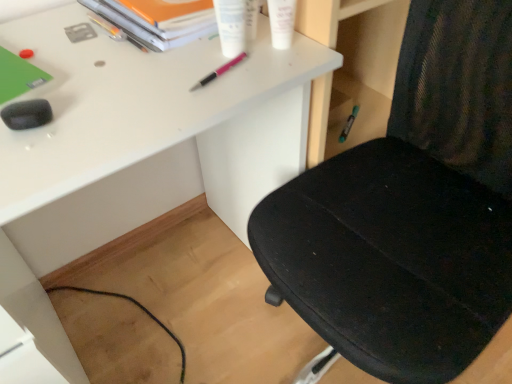
What do you see at coordinates (106, 27) in the screenshot?
I see `metallic silver pen at upper left, the fifth stationery positioned from the front` at bounding box center [106, 27].

What do you see at coordinates (231, 26) in the screenshot?
I see `white plastic tubes at upper center, the fourth stationery positioned from the back` at bounding box center [231, 26].

What are the coordinates of `black mesh chair at right` in the screenshot? It's located at (409, 210).

Where is `teal plastic pen at center-right, arranged as the 1th stationery when viewed from the right`? The width and height of the screenshot is (512, 384). teal plastic pen at center-right, arranged as the 1th stationery when viewed from the right is located at coordinates (348, 124).

What are the coordinates of `orange matte paper at upper center` in the screenshot? It's located at (158, 20).

Find the location of a particular element. This screenshot has width=512, height=384. metallic silver pen at upper left, placed as the 2th stationery when sorted from back to front is located at coordinates (106, 27).

Does white matte tube at upper center, the fifth stationery from the left, touch matte black earbuds at left, the sixth stationery positioned from the back?

No, white matte tube at upper center, the fifth stationery from the left, is not next to matte black earbuds at left, the sixth stationery positioned from the back.

From a real-world perspective, is white matte tube at upper center, which is counted as the second stationery, starting from the front, physically located above or below matte black earbuds at left, the sixth stationery positioned from the back?

white matte tube at upper center, which is counted as the second stationery, starting from the front, is situated higher than matte black earbuds at left, the sixth stationery positioned from the back, in the real world.

Considering the positions of objects white matte tube at upper center, the fifth stationery from the left, and matte black earbuds at left, the first stationery when ordered from left to right, in the image provided, who is more to the right, white matte tube at upper center, the fifth stationery from the left, or matte black earbuds at left, the first stationery when ordered from left to right,?

Positioned to the right is white matte tube at upper center, the fifth stationery from the left.

From a real-world perspective, is matte black earbuds at left, the first stationery when ordered from left to right, physically below black mesh chair at right?

No, from a real-world perspective, matte black earbuds at left, the first stationery when ordered from left to right, is not below black mesh chair at right.

In the scene shown: Is the depth of matte black earbuds at left, the 1th stationery in the front-to-back sequence, less than that of black mesh chair at right?

No, the depth of matte black earbuds at left, the 1th stationery in the front-to-back sequence, is greater than that of black mesh chair at right.

Is matte black earbuds at left, the sixth stationery positioned from the back, oriented away from black mesh chair at right?

No.

From the image's perspective, is matte black earbuds at left, the sixth stationery positioned from the back, located above black mesh chair at right?

Yes, from the image's perspective, matte black earbuds at left, the sixth stationery positioned from the back, is on top of black mesh chair at right.

Is white matte tube at upper center, the fifth stationery from the left, wider or thinner than pink metallic pen at upper center, the 4th stationery when ordered from right to left?

white matte tube at upper center, the fifth stationery from the left, is wider than pink metallic pen at upper center, the 4th stationery when ordered from right to left.

Is white matte tube at upper center, positioned as the 2th stationery in right-to-left order, to the left of pink metallic pen at upper center, the 4th stationery when ordered from right to left, from the viewer's perspective?

No, white matte tube at upper center, positioned as the 2th stationery in right-to-left order, is not to the left of pink metallic pen at upper center, the 4th stationery when ordered from right to left.

From a real-world perspective, which object stands above the other?

white matte tube at upper center, positioned as the 2th stationery in right-to-left order, is physically above.

From the image's perspective, would you say white matte tube at upper center, the fifth stationery from the back, is shown under pink metallic pen at upper center, placed as the third stationery when sorted from back to front?

Incorrect, from the image's perspective, white matte tube at upper center, the fifth stationery from the back, is higher than pink metallic pen at upper center, placed as the third stationery when sorted from back to front.

In terms of width, does pink metallic pen at upper center, the 4th stationery when ordered from right to left, look wider or thinner when compared to matte black earbuds at left, the 1th stationery in the front-to-back sequence?

Considering their sizes, pink metallic pen at upper center, the 4th stationery when ordered from right to left, looks slimmer than matte black earbuds at left, the 1th stationery in the front-to-back sequence.

Is pink metallic pen at upper center, which is the 4th stationery from front to back, surrounding matte black earbuds at left, the first stationery when ordered from left to right?

Definitely not — matte black earbuds at left, the first stationery when ordered from left to right, is not inside pink metallic pen at upper center, which is the 4th stationery from front to back.

Between point (190, 91) and point (21, 118), which one is positioned in front?

Positioned in front is point (21, 118).

In the scene shown: Is pink metallic pen at upper center, the third stationery positioned from the left, to the left of matte black earbuds at left, the 1th stationery in the front-to-back sequence, from the viewer's perspective?

Incorrect, pink metallic pen at upper center, the third stationery positioned from the left, is not on the left side of matte black earbuds at left, the 1th stationery in the front-to-back sequence.

Can you confirm if teal plastic pen at center-right, the first stationery in the back-to-front sequence, is wider than black mesh chair at right?

No, teal plastic pen at center-right, the first stationery in the back-to-front sequence, is not wider than black mesh chair at right.

Is teal plastic pen at center-right, the first stationery in the back-to-front sequence, spatially inside black mesh chair at right, or outside of it?

teal plastic pen at center-right, the first stationery in the back-to-front sequence, exists outside the volume of black mesh chair at right.

Considering the relative sizes of teal plastic pen at center-right, acting as the sixth stationery starting from the front, and black mesh chair at right in the image provided, is teal plastic pen at center-right, acting as the sixth stationery starting from the front, bigger than black mesh chair at right?

No, teal plastic pen at center-right, acting as the sixth stationery starting from the front, is not bigger than black mesh chair at right.

Is teal plastic pen at center-right, acting as the sixth stationery starting from the front, far away from black mesh chair at right?

No.

From the image's perspective, is teal plastic pen at center-right, acting as the sixth stationery starting from the front, under orange matte paper at upper center?

Yes, from the image's perspective, teal plastic pen at center-right, acting as the sixth stationery starting from the front, is beneath orange matte paper at upper center.

In terms of size, does teal plastic pen at center-right, acting as the sixth stationery starting from the front, appear bigger or smaller than orange matte paper at upper center?

In the image, teal plastic pen at center-right, acting as the sixth stationery starting from the front, appears to be smaller than orange matte paper at upper center.

From the picture: Is teal plastic pen at center-right, acting as the sixth stationery starting from the front, facing towards orange matte paper at upper center?

No, teal plastic pen at center-right, acting as the sixth stationery starting from the front, is not turned towards orange matte paper at upper center.

Is white matte tube at upper center, the fifth stationery from the back, not inside orange matte paper at upper center?

Yes.

How different are the orientations of white matte tube at upper center, the fifth stationery from the back, and orange matte paper at upper center in degrees?

They differ by 25.2 degrees in their facing directions.

Can you confirm if white matte tube at upper center, which is counted as the second stationery, starting from the front, is bigger than orange matte paper at upper center?

No.

Are white matte tube at upper center, positioned as the 2th stationery in right-to-left order, and orange matte paper at upper center located far from each other?

No, there isn't a large distance between white matte tube at upper center, positioned as the 2th stationery in right-to-left order, and orange matte paper at upper center.

At what (x,y) coordinates should I click in order to perform the action: click on the 4th stationery to the right of the matte black earbuds at left, the sixth stationery positioned from the back, counting from the anchor's position. Please return your answer as a coordinate pair (x, y). Looking at the image, I should click on (281, 22).

From the black mesh chair at right, count the 6th stationery to the left and point to it. Please provide its 2D coordinates.

[(27, 114)]

Consider the image. Estimate the real-world distances between objects in this image. Which object is closer to matte black earbuds at left, the 1th stationery in the front-to-back sequence, teal plastic pen at center-right, acting as the sixth stationery starting from the front, or white matte tube at upper center, which is counted as the second stationery, starting from the front?

The object closer to matte black earbuds at left, the 1th stationery in the front-to-back sequence, is white matte tube at upper center, which is counted as the second stationery, starting from the front.

From the image, which object appears to be nearer to pink metallic pen at upper center, which is the 4th stationery from front to back, white plastic tubes at upper center, which ranks as the 3th stationery in front-to-back order, or metallic silver pen at upper left, the second stationery viewed from the left?

The object closer to pink metallic pen at upper center, which is the 4th stationery from front to back, is white plastic tubes at upper center, which ranks as the 3th stationery in front-to-back order.

When comparing their distances from metallic silver pen at upper left, which is the 5th stationery in right-to-left order, does pink metallic pen at upper center, placed as the third stationery when sorted from back to front, or white matte tube at upper center, the fifth stationery from the left, seem closer?

pink metallic pen at upper center, placed as the third stationery when sorted from back to front, lies closer to metallic silver pen at upper left, which is the 5th stationery in right-to-left order, than the other object.

Looking at the image, which one is located further to white plastic tubes at upper center, which is counted as the third stationery, starting from the right, matte black earbuds at left, the first stationery when ordered from left to right, or teal plastic pen at center-right, the sixth stationery when ordered from left to right?

teal plastic pen at center-right, the sixth stationery when ordered from left to right, is positioned further to the anchor white plastic tubes at upper center, which is counted as the third stationery, starting from the right.

Looking at this image, from the image, which object appears to be nearer to black mesh chair at right, teal plastic pen at center-right, acting as the sixth stationery starting from the front, or matte black earbuds at left, the first stationery when ordered from left to right?

teal plastic pen at center-right, acting as the sixth stationery starting from the front, is positioned closer to the anchor black mesh chair at right.

Based on their spatial positions, is black mesh chair at right or pink metallic pen at upper center, placed as the third stationery when sorted from back to front, further from white matte desk at center?

The object further to white matte desk at center is pink metallic pen at upper center, placed as the third stationery when sorted from back to front.

When comparing their distances from white matte tube at upper center, the fifth stationery from the left, does teal plastic pen at center-right, the first stationery in the back-to-front sequence, or white plastic tubes at upper center, the fourth stationery positioned from the back, seem closer?

white plastic tubes at upper center, the fourth stationery positioned from the back, is positioned closer to the anchor white matte tube at upper center, the fifth stationery from the left.

Based on their spatial positions, is pink metallic pen at upper center, which is the 4th stationery from front to back, or white matte desk at center further from orange matte paper at upper center?

white matte desk at center is positioned further to the anchor orange matte paper at upper center.

Where is `paperback book located between metallic silver pen at upper left, which is the 5th stationery in right-to-left order, and teal plastic pen at center-right, acting as the sixth stationery starting from the front, in the left-right direction`? This screenshot has height=384, width=512. paperback book located between metallic silver pen at upper left, which is the 5th stationery in right-to-left order, and teal plastic pen at center-right, acting as the sixth stationery starting from the front, in the left-right direction is located at coordinates (158, 20).

Identify the location of paperback book between white matte desk at center and teal plastic pen at center-right, the sixth stationery when ordered from left to right, from front to back. (158, 20).

Locate an element on the screen. paperback book between white plastic tubes at upper center, positioned as the 4th stationery in left-to-right order, and teal plastic pen at center-right, arranged as the 1th stationery when viewed from the right, in the front-back direction is located at coordinates (158, 20).

Image resolution: width=512 pixels, height=384 pixels. In order to click on paperback book between matte black earbuds at left, the first stationery when ordered from left to right, and black mesh chair at right, in the horizontal direction in this screenshot , I will do 158,20.